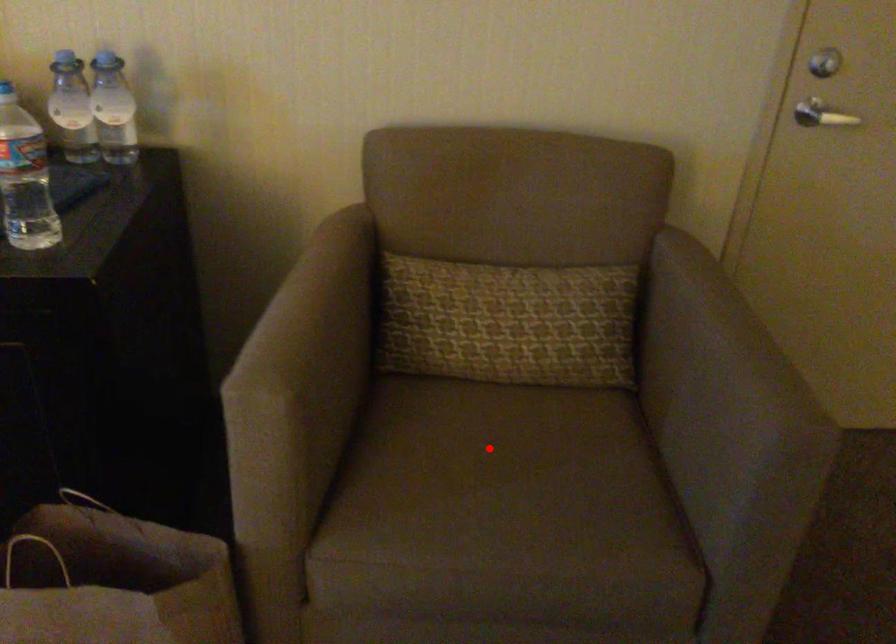
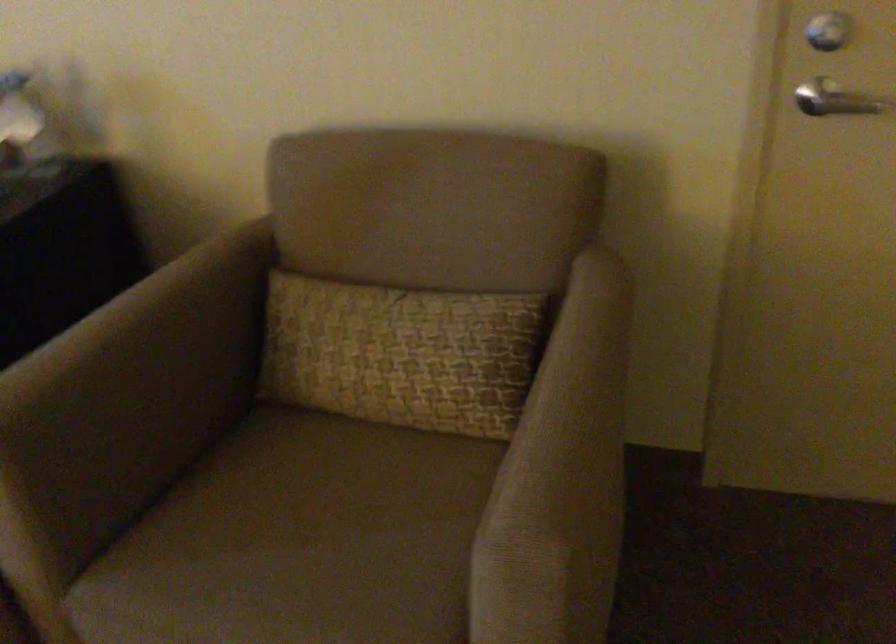
Question: I am providing you with two images of the same scene from different viewpoints. Given a red point in image1, look at the same physical point in image2. Is it:

Choices:
 (A) Closer to the viewpoint
 (B) Farther from the viewpoint

Answer: (A)